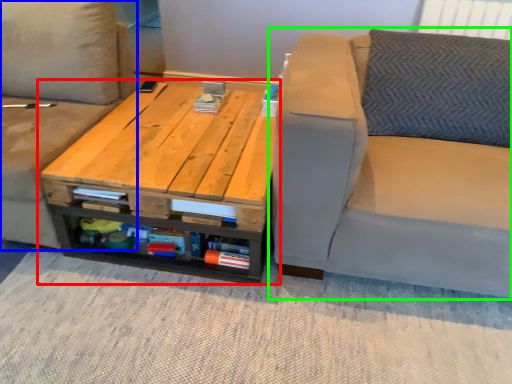
Question: Estimate the real-world distances between objects in this image. Which object is closer to table (highlighted by a red box), studio couch (highlighted by a blue box) or studio couch (highlighted by a green box)?

Choices:
 (A) studio couch
 (B) studio couch

Answer: (A)